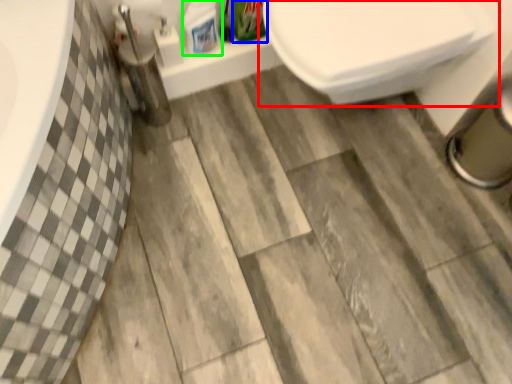
Question: Which object is positioned closest to toilet (highlighted by a red box)? Select from cleaning product (highlighted by a blue box) and cleaning product (highlighted by a green box).

Choices:
 (A) cleaning product
 (B) cleaning product

Answer: (A)